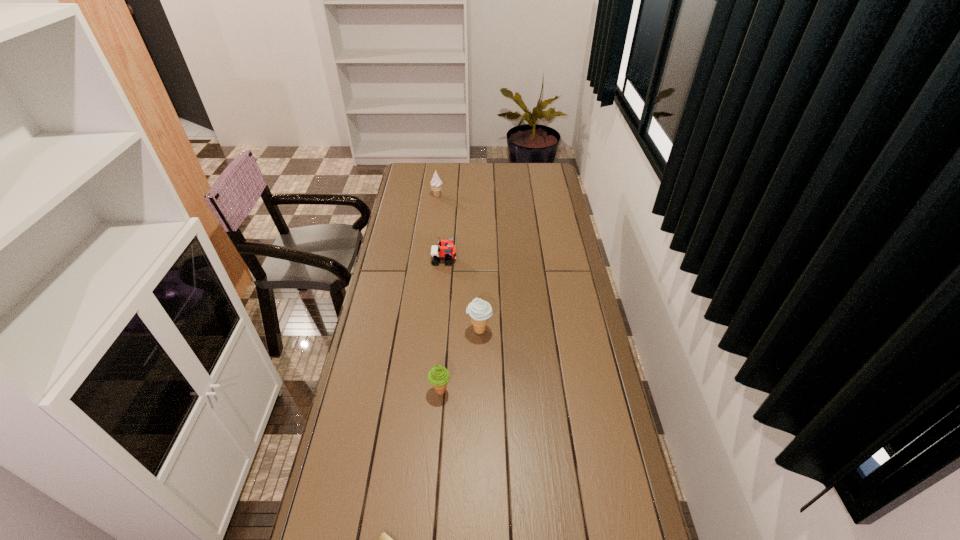
Find the location of a particular element. The width and height of the screenshot is (960, 540). the second farthest icecream is located at coordinates (480, 311).

Where is `the rightmost icecream`? The image size is (960, 540). the rightmost icecream is located at coordinates (480, 311).

Find the location of a particular element. The image size is (960, 540). the leftmost icecream is located at coordinates (436, 184).

Identify the location of the farthest icecream. The width and height of the screenshot is (960, 540). 436,184.

You are a GUI agent. You are given a task and a screenshot of the screen. Output one action in this format:
    pyautogui.click(x=<x>, y=<y>)
    Task: Click on the nearest icecream
    This screenshot has height=540, width=960.
    Given the screenshot: What is the action you would take?
    pyautogui.click(x=438, y=376)

Identify the location of the second nearest object. The height and width of the screenshot is (540, 960). (438, 376).

Find the location of a particular element. Image resolution: width=960 pixels, height=540 pixels. the second shortest object is located at coordinates (447, 251).

Find the location of a particular element. The height and width of the screenshot is (540, 960). Lego is located at coordinates (x=447, y=251).

Where is `free spot located on the left of the third nearest object`? free spot located on the left of the third nearest object is located at coordinates (370, 330).

Locate an element on the screen. The width and height of the screenshot is (960, 540). vacant space located 0.110m on the front-facing side of the farthest object is located at coordinates (465, 195).